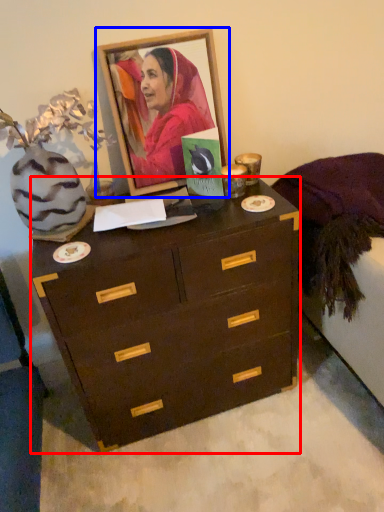
Question: Which object is further to the camera taking this photo, chest of drawers (highlighted by a red box) or picture frame (highlighted by a blue box)?

Choices:
 (A) chest of drawers
 (B) picture frame

Answer: (B)